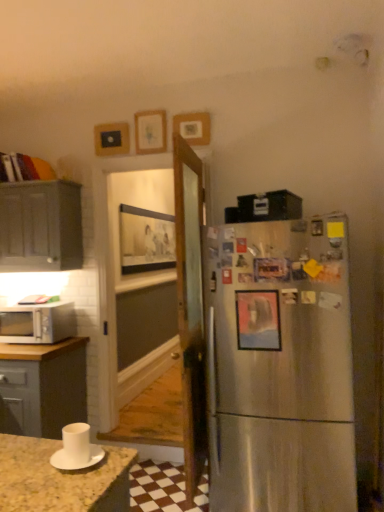
Question: From the image's perspective, is matte gray cabinet at left on top of wooden picture frame at upper center, the first picture frame when ordered from top to bottom?

Choices:
 (A) yes
 (B) no

Answer: (B)

Question: Is matte gray cabinet at left positioned beyond the bounds of wooden picture frame at upper center, marked as the 3th picture frame in a front-to-back arrangement?

Choices:
 (A) no
 (B) yes

Answer: (B)

Question: Is matte gray cabinet at left thinner than wooden picture frame at upper center, the fifth picture frame from the bottom?

Choices:
 (A) no
 (B) yes

Answer: (A)

Question: Is matte gray cabinet at left bigger than wooden picture frame at upper center, the fifth picture frame from the bottom?

Choices:
 (A) no
 (B) yes

Answer: (B)

Question: Is wooden picture frame at upper center, arranged as the third picture frame when viewed from the back, a part of matte gray cabinet at left?

Choices:
 (A) no
 (B) yes

Answer: (A)

Question: Is point (127, 224) positioned closer to the camera than point (77, 198)?

Choices:
 (A) farther
 (B) closer

Answer: (A)

Question: Considering the positions of wooden picture frame at center, arranged as the fifth picture frame when viewed from the front, and matte gray cabinet at left in the image, is wooden picture frame at center, arranged as the fifth picture frame when viewed from the front, wider or thinner than matte gray cabinet at left?

Choices:
 (A) wide
 (B) thin

Answer: (B)

Question: Relative to matte gray cabinet at left, is wooden picture frame at center, arranged as the fifth picture frame when viewed from the front, in front or behind?

Choices:
 (A) behind
 (B) front

Answer: (A)

Question: Considering the positions of wooden picture frame at center, arranged as the fifth picture frame when viewed from the front, and matte gray cabinet at left in the image, is wooden picture frame at center, arranged as the fifth picture frame when viewed from the front, taller or shorter than matte gray cabinet at left?

Choices:
 (A) short
 (B) tall

Answer: (B)

Question: In terms of width, does metallic rectangular frame at upper center, positioned as the fourth picture frame in front-to-back order, look wider or thinner when compared to wooden picture frame at center, acting as the 1th picture frame starting from the back?

Choices:
 (A) thin
 (B) wide

Answer: (A)

Question: From a real-world perspective, is metallic rectangular frame at upper center, positioned as the 2th picture frame in back-to-front order, above or below wooden picture frame at center, arranged as the fifth picture frame when viewed from the front?

Choices:
 (A) above
 (B) below

Answer: (A)

Question: Is metallic rectangular frame at upper center, the third picture frame from the top, to the left or to the right of wooden picture frame at center, arranged as the fifth picture frame when viewed from the front, in the image?

Choices:
 (A) left
 (B) right

Answer: (A)

Question: From the image's perspective, is metallic rectangular frame at upper center, positioned as the 2th picture frame in back-to-front order, above or below wooden picture frame at center, the 4th picture frame in the top-to-bottom sequence?

Choices:
 (A) below
 (B) above

Answer: (B)

Question: From a real-world perspective, is wooden picture frame at upper center, the fourth picture frame positioned from the bottom, physically located above or below metallic silver picture frame at right, positioned as the first picture frame in bottom-to-top order?

Choices:
 (A) above
 (B) below

Answer: (A)

Question: Looking at the image, does wooden picture frame at upper center, the 2th picture frame in the front-to-back sequence, seem bigger or smaller compared to metallic silver picture frame at right, which is the first picture frame in front-to-back order?

Choices:
 (A) small
 (B) big

Answer: (B)